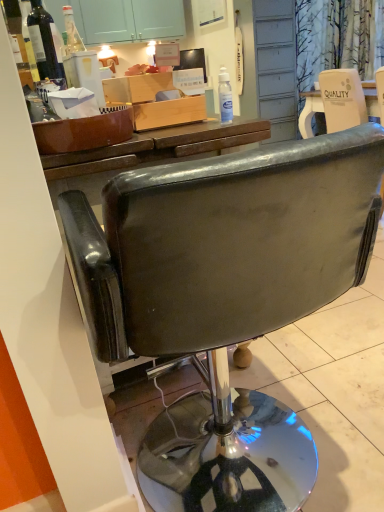
Question: Does matte black television at upper center have a smaller size compared to transparent plastic bottle at upper center, which is the first bottle from right to left?

Choices:
 (A) yes
 (B) no

Answer: (B)

Question: Is matte black television at upper center oriented away from transparent plastic bottle at upper center, which is the first bottle from right to left?

Choices:
 (A) no
 (B) yes

Answer: (A)

Question: Is transparent plastic bottle at upper center, placed as the second bottle when sorted from top to bottom, inside matte black television at upper center?

Choices:
 (A) no
 (B) yes

Answer: (A)

Question: Is matte black television at upper center at the left side of transparent plastic bottle at upper center, positioned as the second bottle in left-to-right order?

Choices:
 (A) no
 (B) yes

Answer: (B)

Question: Can you see matte black television at upper center touching transparent plastic bottle at upper center, marked as the first bottle in a bottom-to-top arrangement?

Choices:
 (A) yes
 (B) no

Answer: (A)

Question: Considering the positions of dark glass bottle at upper left, which is the second bottle in right-to-left order, and wooden box at center in the image, is dark glass bottle at upper left, which is the second bottle in right-to-left order, bigger or smaller than wooden box at center?

Choices:
 (A) big
 (B) small

Answer: (B)

Question: From the image's perspective, is dark glass bottle at upper left, which is the first bottle from top to bottom, above or below wooden box at center?

Choices:
 (A) below
 (B) above

Answer: (B)

Question: From their relative heights in the image, would you say dark glass bottle at upper left, which is the first bottle in left-to-right order, is taller or shorter than wooden box at center?

Choices:
 (A) tall
 (B) short

Answer: (A)

Question: From a real-world perspective, is dark glass bottle at upper left, which is the first bottle from top to bottom, positioned above or below wooden box at center?

Choices:
 (A) above
 (B) below

Answer: (A)

Question: Is leather-like black chair at center spatially inside wooden box at center, or outside of it?

Choices:
 (A) outside
 (B) inside

Answer: (A)

Question: Is leather-like black chair at center wider or thinner than wooden box at center?

Choices:
 (A) wide
 (B) thin

Answer: (A)

Question: Is point (317, 179) positioned closer to the camera than point (173, 99)?

Choices:
 (A) closer
 (B) farther

Answer: (A)

Question: Considering their positions, is leather-like black chair at center located in front of or behind wooden box at center?

Choices:
 (A) front
 (B) behind

Answer: (A)

Question: Looking at their shapes, would you say matte black television at upper center is wider or thinner than dark glass bottle at upper left, which is the first bottle in left-to-right order?

Choices:
 (A) wide
 (B) thin

Answer: (B)

Question: Based on their sizes in the image, would you say matte black television at upper center is bigger or smaller than dark glass bottle at upper left, which is the 2th bottle in bottom-to-top order?

Choices:
 (A) big
 (B) small

Answer: (A)